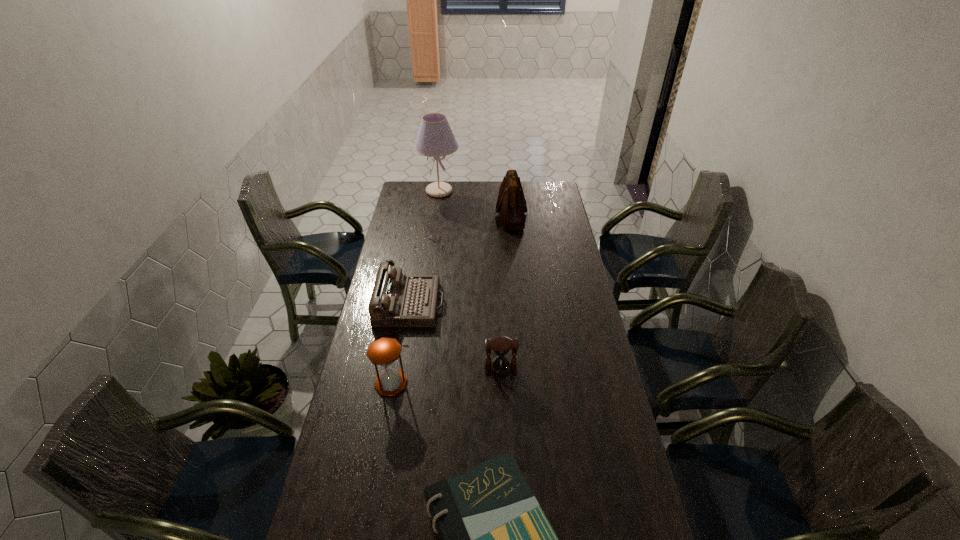
Where is `lampshade`? The height and width of the screenshot is (540, 960). lampshade is located at coordinates (435, 138).

Where is `shoulder bag`? This screenshot has width=960, height=540. shoulder bag is located at coordinates (511, 204).

The height and width of the screenshot is (540, 960). What are the coordinates of `the left hourglass` in the screenshot? It's located at (384, 351).

Find the location of a particular element. The image size is (960, 540). the third tallest object is located at coordinates tap(384, 351).

The width and height of the screenshot is (960, 540). Find the location of `typewriter`. typewriter is located at coordinates (398, 300).

At what (x,y) coordinates should I click in order to perform the action: click on the shorter hourglass. Please return your answer as a coordinate pair (x, y). The height and width of the screenshot is (540, 960). Looking at the image, I should click on (501, 345).

You are a GUI agent. You are given a task and a screenshot of the screen. Output one action in this format:
    pyautogui.click(x=<x>, y=<y>)
    Task: Click on the free space located 0.290m on the front of the lampshade
    Image resolution: width=960 pixels, height=540 pixels.
    Given the screenshot: What is the action you would take?
    pyautogui.click(x=434, y=232)

Image resolution: width=960 pixels, height=540 pixels. What are the coordinates of `vacant point located on the front of the second tallest object` in the screenshot? It's located at (517, 279).

The height and width of the screenshot is (540, 960). What are the coordinates of `vacant space situated on the back of the fourth shortest object` in the screenshot? It's located at (403, 319).

You are a GUI agent. You are given a task and a screenshot of the screen. Output one action in this format:
    pyautogui.click(x=<x>, y=<y>)
    Task: Click on the vacant space situated 0.210m on the keyboard of the typewriter
    
    Given the screenshot: What is the action you would take?
    pyautogui.click(x=493, y=304)